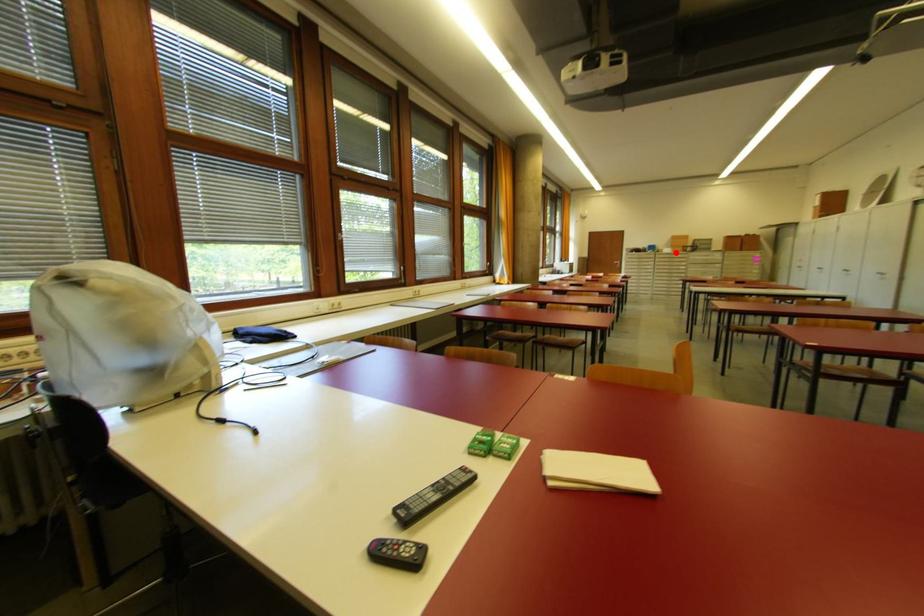
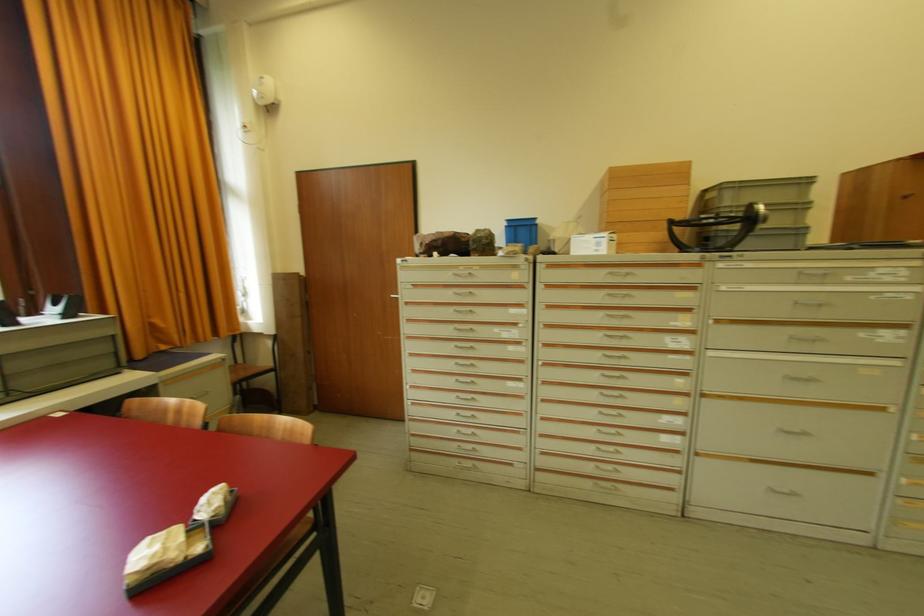
Where in the second image is the point corresponding to the highlighted location from the first image?

(623, 248)